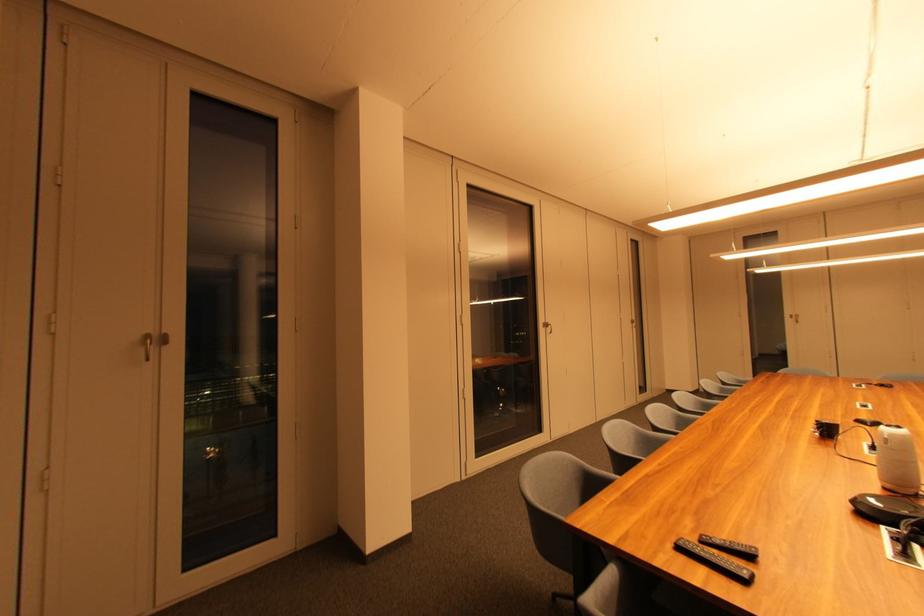
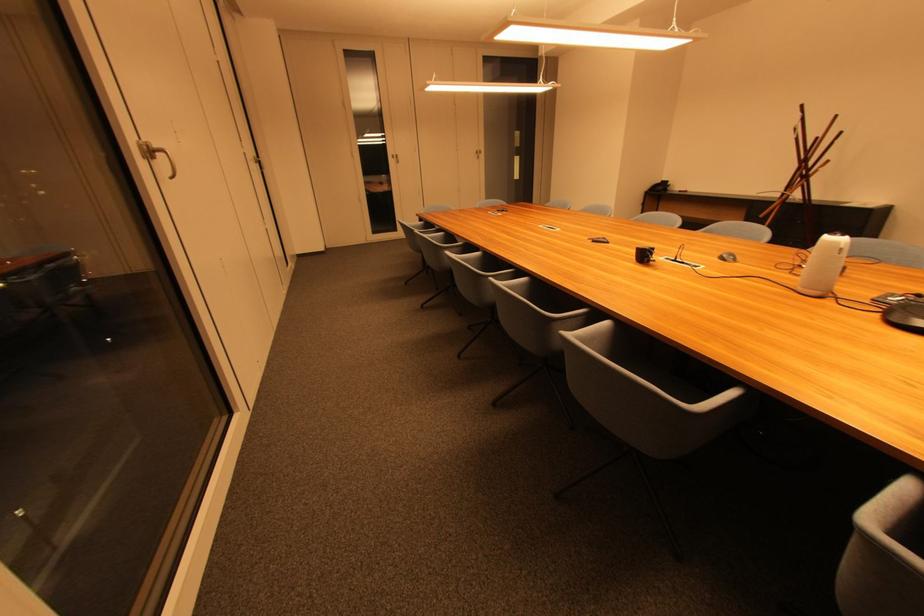
Find the pixel in the second image that matches the point at 549,329 in the first image.

(148, 159)